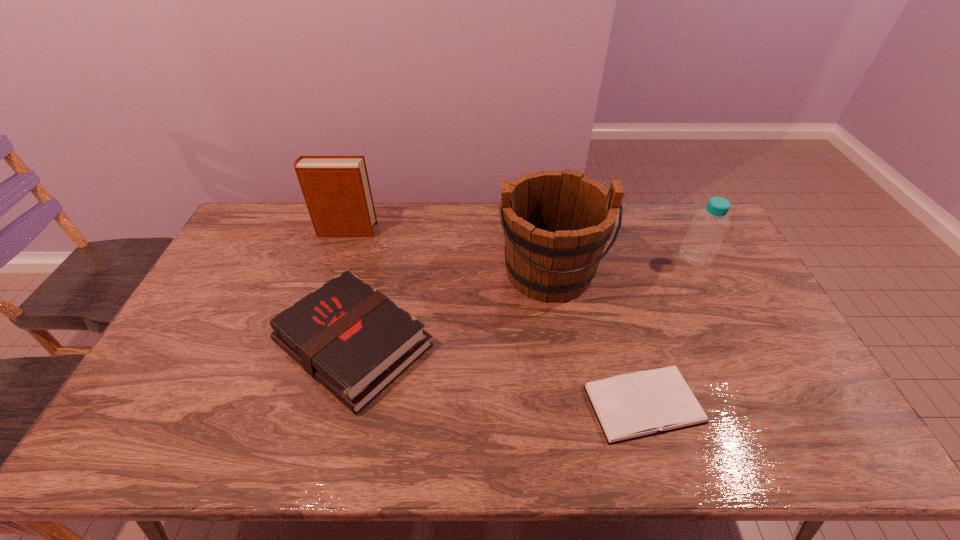
Locate an element on the screen. the closest hardback book to the rightmost object is located at coordinates (630, 406).

I want to click on hardback book identified as the closest to the shortest hardback book, so click(352, 339).

The image size is (960, 540). In order to click on free space in the image that satisfies the following two spatial constraints: 1. on the open cover of the shortest object; 2. on the left side of the farthest object in this screenshot , I will do tap(287, 404).

Locate an element on the screen. Image resolution: width=960 pixels, height=540 pixels. free space that satisfies the following two spatial constraints: 1. on the open cover of the tallest hardback book; 2. on the right side of the third tallest object is located at coordinates (337, 259).

Where is `free space that satisfies the following two spatial constraints: 1. on the open cover of the shortest object; 2. on the right side of the farthest hardback book`? The height and width of the screenshot is (540, 960). free space that satisfies the following two spatial constraints: 1. on the open cover of the shortest object; 2. on the right side of the farthest hardback book is located at coordinates (287, 404).

Where is `vacant space that satisfies the following two spatial constraints: 1. on the open cover of the second tallest object; 2. on the back side of the fourth tallest object`? This screenshot has height=540, width=960. vacant space that satisfies the following two spatial constraints: 1. on the open cover of the second tallest object; 2. on the back side of the fourth tallest object is located at coordinates (308, 345).

Find the location of a particular element. This screenshot has width=960, height=540. vacant area in the image that satisfies the following two spatial constraints: 1. on the open cover of the farthest hardback book; 2. on the right side of the third tallest object is located at coordinates (337, 259).